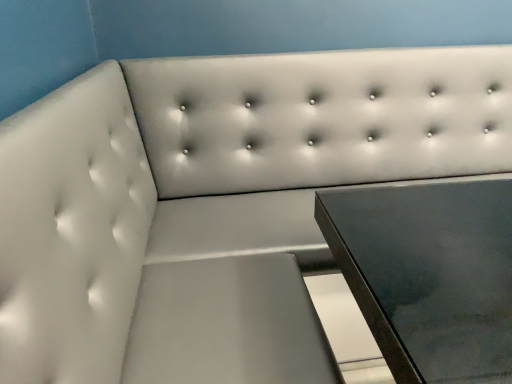
Describe the element at coordinates (429, 275) in the screenshot. The width and height of the screenshot is (512, 384). I see `metallic glass table at lower right` at that location.

What is the approximate height of metallic glass table at lower right?

metallic glass table at lower right is 30.43 inches tall.

Locate an element on the screen. metallic glass table at lower right is located at coordinates (429, 275).

Measure the distance between point (466, 374) and camera.

Point (466, 374) and camera are 23.46 inches apart from each other.

Identify the location of metallic glass table at lower right. (429, 275).